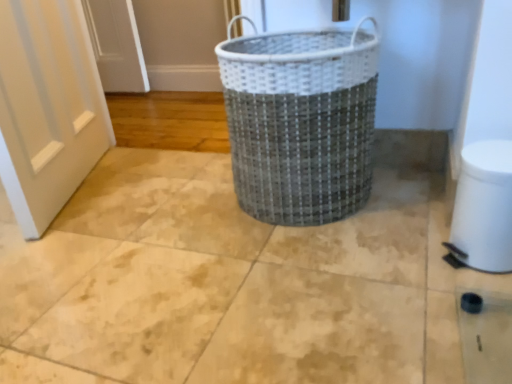
Question: From the image's perspective, is white plastic toilet bowl at lower right positioned above or below metallic woven basket at center?

Choices:
 (A) above
 (B) below

Answer: (B)

Question: In the image, is white plastic toilet bowl at lower right positioned in front of or behind metallic woven basket at center?

Choices:
 (A) behind
 (B) front

Answer: (B)

Question: From a real-world perspective, relative to metallic woven basket at center, is white plastic toilet bowl at lower right vertically above or below?

Choices:
 (A) above
 (B) below

Answer: (B)

Question: Which is correct: metallic woven basket at center is inside white plastic toilet bowl at lower right, or outside of it?

Choices:
 (A) outside
 (B) inside

Answer: (A)

Question: Considering the positions of metallic woven basket at center and white plastic toilet bowl at lower right in the image, is metallic woven basket at center bigger or smaller than white plastic toilet bowl at lower right?

Choices:
 (A) small
 (B) big

Answer: (B)

Question: From the image's perspective, is metallic woven basket at center located above or below white plastic toilet bowl at lower right?

Choices:
 (A) below
 (B) above

Answer: (B)

Question: In terms of height, does metallic woven basket at center look taller or shorter compared to white plastic toilet bowl at lower right?

Choices:
 (A) short
 (B) tall

Answer: (B)